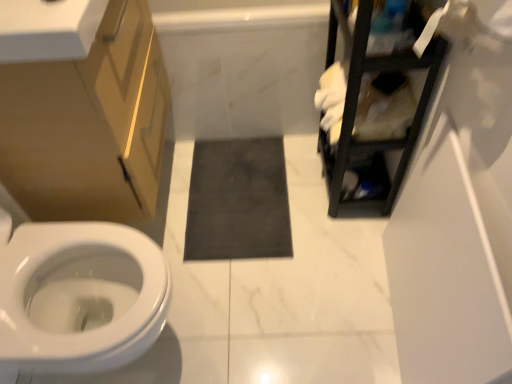
The width and height of the screenshot is (512, 384). Identify the location of vacant position to the left of white marble bath at center. (204, 162).